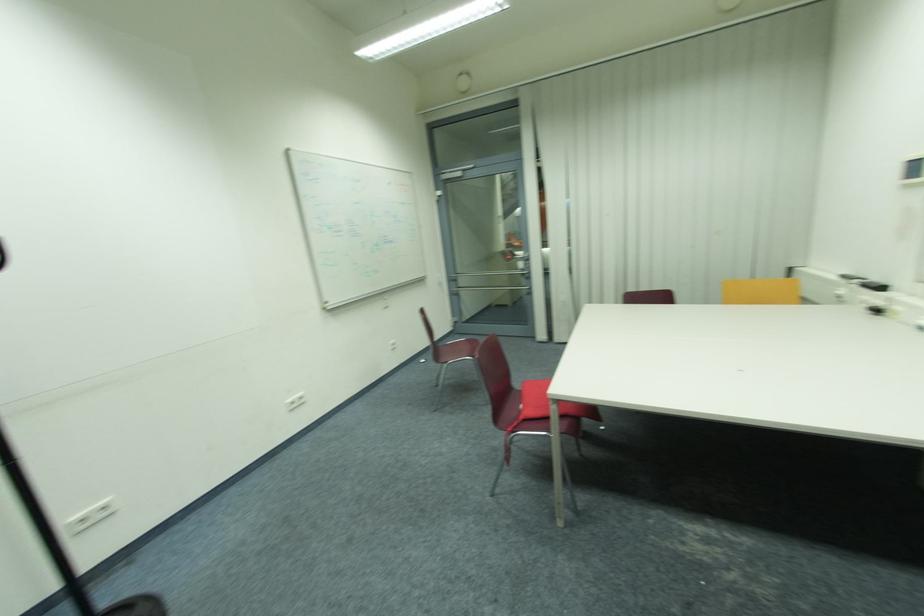
Where would you plac the whiteboard marker tray? Please return your answer as a coordinate pair (x, y).

(351, 299)